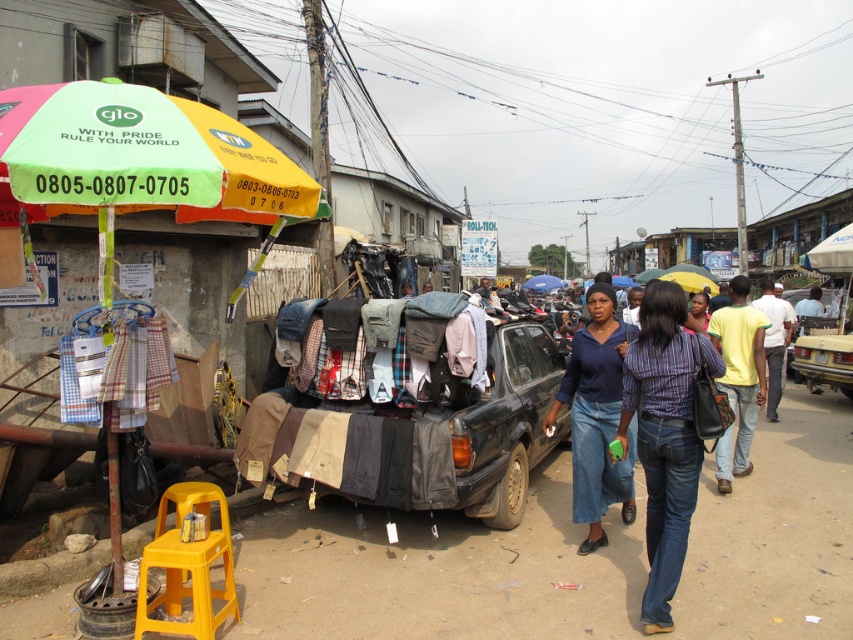
Question: Can you confirm if plastic umbrella at left is positioned below black matte car at center?

Choices:
 (A) no
 (B) yes

Answer: (A)

Question: Is plastic umbrella at left to the right of white cotton shirt at center from the viewer's perspective?

Choices:
 (A) yes
 (B) no

Answer: (B)

Question: Which point is closer to the camera?

Choices:
 (A) (136, 128)
 (B) (746, 362)
 (C) (614, 417)

Answer: (A)

Question: Which object is the farthest from the matte green umbrella at center?

Choices:
 (A) white cotton shirt at center
 (B) yellow cotton shirt at right

Answer: (B)

Question: Which point is closer to the camera?

Choices:
 (A) (601, 376)
 (B) (776, 401)
 (C) (689, 435)

Answer: (C)

Question: Does striped cotton shirt at center come behind yellow cotton shirt at right?

Choices:
 (A) no
 (B) yes

Answer: (A)